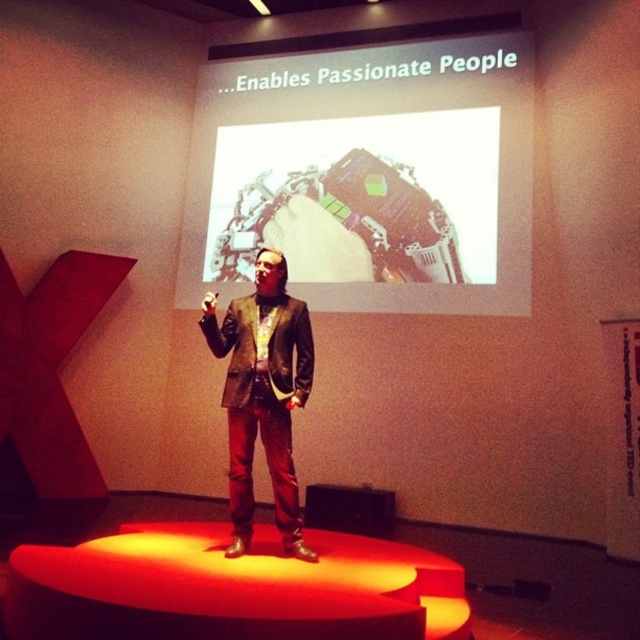
Between point (484, 93) and point (241, 483), which one is positioned in front?

Point (241, 483) is in front.

Can you confirm if white matte projection screen at upper center is shorter than brown leather jacket at center?

No, white matte projection screen at upper center is not shorter than brown leather jacket at center.

This screenshot has width=640, height=640. What do you see at coordinates (368, 177) in the screenshot?
I see `white matte projection screen at upper center` at bounding box center [368, 177].

At what (x,y) coordinates should I click in order to perform the action: click on white matte projection screen at upper center. Please return your answer as a coordinate pair (x, y). Looking at the image, I should click on (368, 177).